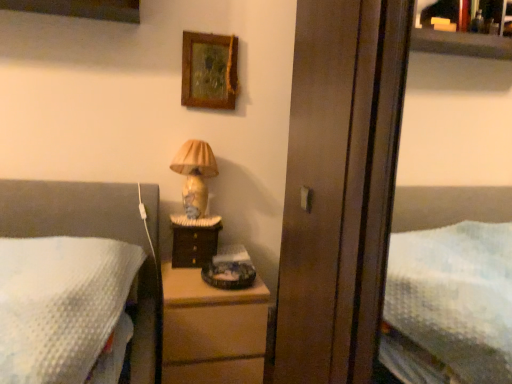
Question: Considering the relative sizes of wooden picture frame at upper center and matte ceramic lamp at upper center in the image provided, is wooden picture frame at upper center wider than matte ceramic lamp at upper center?

Choices:
 (A) no
 (B) yes

Answer: (A)

Question: Considering the relative positions of wooden picture frame at upper center and matte ceramic lamp at upper center in the image provided, is wooden picture frame at upper center in front of matte ceramic lamp at upper center?

Choices:
 (A) no
 (B) yes

Answer: (A)

Question: Considering the relative sizes of wooden picture frame at upper center and matte ceramic lamp at upper center in the image provided, is wooden picture frame at upper center thinner than matte ceramic lamp at upper center?

Choices:
 (A) no
 (B) yes

Answer: (B)

Question: From the image's perspective, is wooden picture frame at upper center beneath matte ceramic lamp at upper center?

Choices:
 (A) yes
 (B) no

Answer: (B)

Question: Is wooden picture frame at upper center turned away from matte ceramic lamp at upper center?

Choices:
 (A) no
 (B) yes

Answer: (A)

Question: From the image's perspective, is wooden picture frame at upper center positioned above or below wooden screen door at center?

Choices:
 (A) below
 (B) above

Answer: (B)

Question: Is wooden picture frame at upper center wider or thinner than wooden screen door at center?

Choices:
 (A) wide
 (B) thin

Answer: (B)

Question: In the image, is wooden picture frame at upper center on the left side or the right side of wooden screen door at center?

Choices:
 (A) left
 (B) right

Answer: (A)

Question: Considering the positions of wooden picture frame at upper center and wooden screen door at center in the image, is wooden picture frame at upper center taller or shorter than wooden screen door at center?

Choices:
 (A) short
 (B) tall

Answer: (A)

Question: Is wooden screen door at center bigger or smaller than matte ceramic lamp at upper center?

Choices:
 (A) small
 (B) big

Answer: (B)

Question: From a real-world perspective, relative to matte ceramic lamp at upper center, is wooden screen door at center vertically above or below?

Choices:
 (A) above
 (B) below

Answer: (A)

Question: Is wooden screen door at center taller or shorter than matte ceramic lamp at upper center?

Choices:
 (A) tall
 (B) short

Answer: (A)

Question: Choose the correct answer: Is wooden screen door at center inside matte ceramic lamp at upper center or outside it?

Choices:
 (A) inside
 (B) outside

Answer: (B)

Question: Is wooden picture frame at upper center taller or shorter than matte ceramic lamp at upper center?

Choices:
 (A) tall
 (B) short

Answer: (B)

Question: Looking at the image, does wooden picture frame at upper center seem bigger or smaller compared to matte ceramic lamp at upper center?

Choices:
 (A) small
 (B) big

Answer: (A)